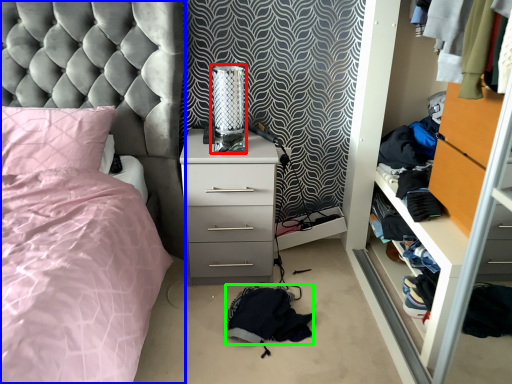
Question: Which is farther away from table lamp (highlighted by a red box)? bed (highlighted by a blue box) or clothing (highlighted by a green box)?

Choices:
 (A) bed
 (B) clothing

Answer: (B)